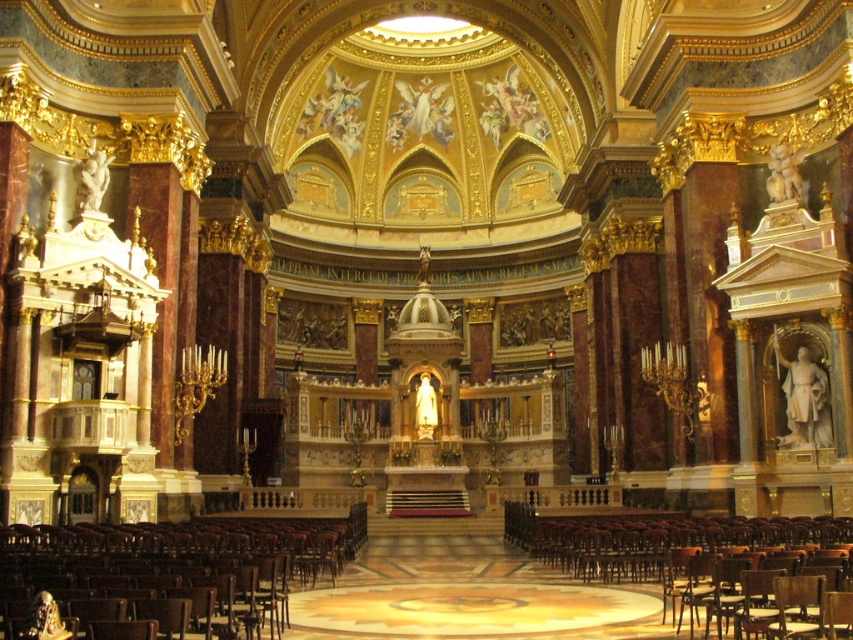
In the scene shown: You are standing in the grand cathedral and want to sit down. There is a wooden polished chair at lower left. Is the point at coordinates (181, 563) on the chair?

Yes, the point at coordinates (181, 563) is on the wooden polished chair at lower left.

You are standing at the entrance of the grand cathedral and notice two points marked in the scene. The first point is at coordinate point (114, 547) and the second is at point (846, 520). Which of these two points is closer to you as you face the altar?

Point (114, 547) is in front of point (846, 520), so it is closer to you as you face the altar.